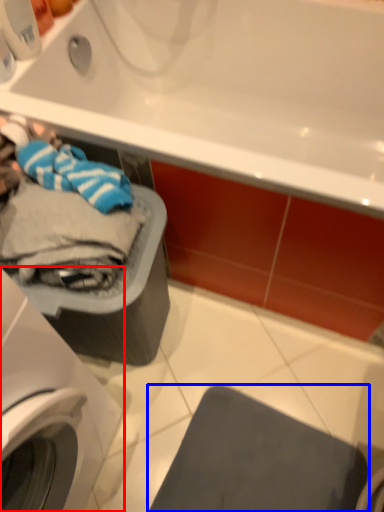
Question: Which of the following is the farthest to the observer, washing machine (highlighted by a red box) or gray (highlighted by a blue box)?

Choices:
 (A) washing machine
 (B) gray

Answer: (B)